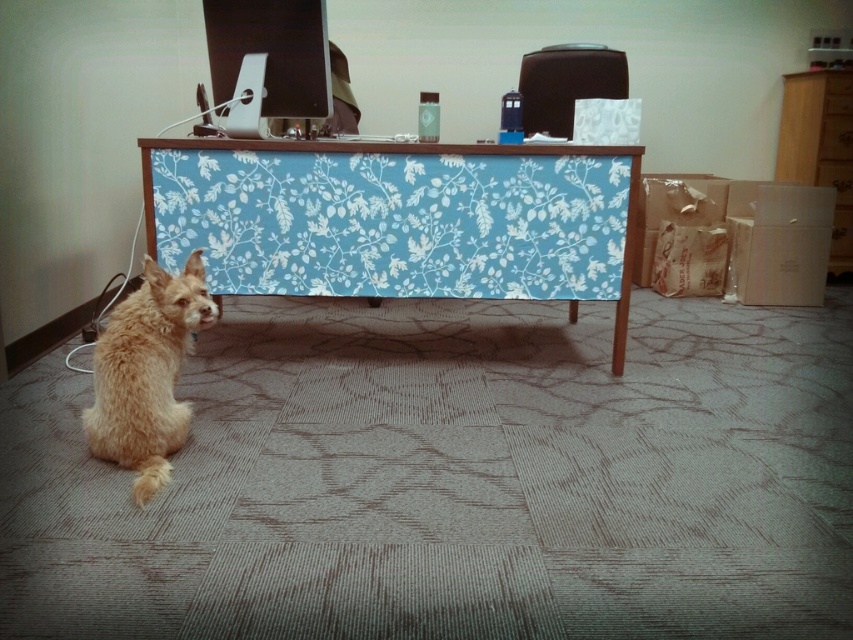
Based on the scene description, where is the metallic silver monitor at upper center located in the image?

The metallic silver monitor at upper center is located at point (271,51).

You are organizing your workspace and want to place a new item between the brown wood dresser at upper right and the matte black speaker at upper center. Based on their positions, is there enough vertical space between them to fit the item?

The brown wood dresser at upper right is below the matte black speaker at upper center, so there is vertical space between them. However, the exact amount of space isn not specified, so it depends on the item size.